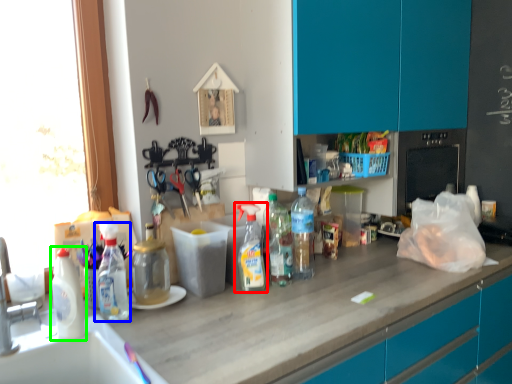
Question: Based on their relative distances, which object is farther from bottle (highlighted by a red box)? Choose from bottle (highlighted by a blue box) and bottle (highlighted by a green box).

Choices:
 (A) bottle
 (B) bottle

Answer: (B)